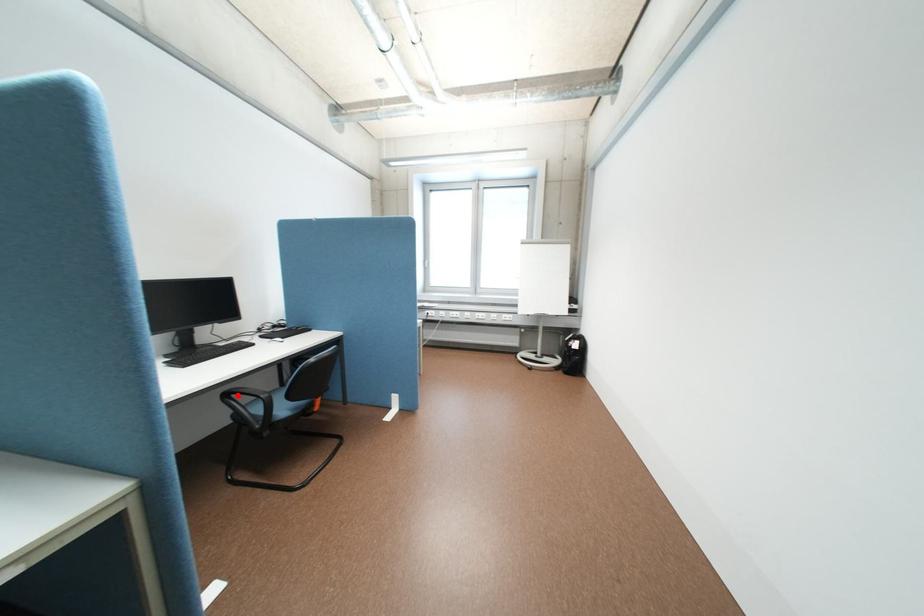
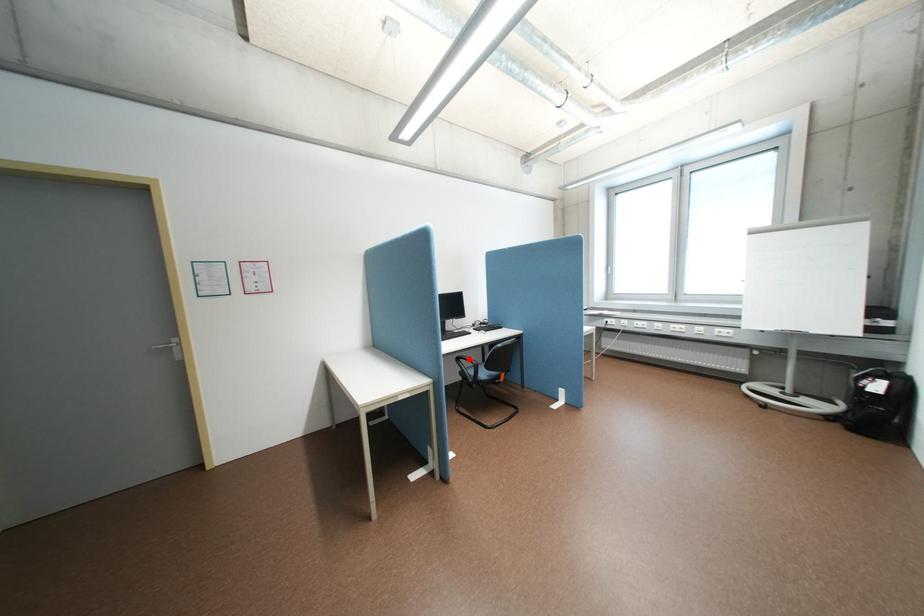
From the picture: I am providing you with two images of the same scene from different viewpoints. A red point is marked on the first image and another point is marked on the second image. Are the points marked in image1 and image2 representing the same 3D position?

Yes